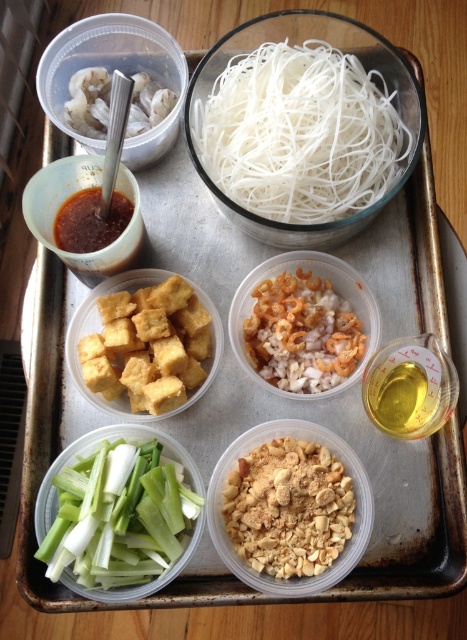
Question: Which point is closer to the camera?

Choices:
 (A) (126, 33)
 (B) (154, 490)
 (C) (87, 88)
 (D) (129, 339)

Answer: (B)

Question: Which of these objects is positioned farthest from the smokey brown paste at center left?

Choices:
 (A) yellow crispy tofu at center
 (B) translucent plastic container with shrimp at upper left
 (C) brown crunchy nuts at center

Answer: (C)

Question: Which of the following is the closest to the observer?

Choices:
 (A) (106, 237)
 (B) (278, 298)
 (C) (107, 83)

Answer: (A)

Question: Where is brown rice with crispy topping at center located in relation to translucent plastic container with shrimp at upper left in the image?

Choices:
 (A) above
 (B) below

Answer: (B)

Question: Does brown crunchy nuts at center appear over brown rice with crispy topping at center?

Choices:
 (A) yes
 (B) no

Answer: (B)

Question: Is translucent plastic container with shrimp at upper left closer to the viewer compared to smokey brown paste at center left?

Choices:
 (A) no
 (B) yes

Answer: (B)